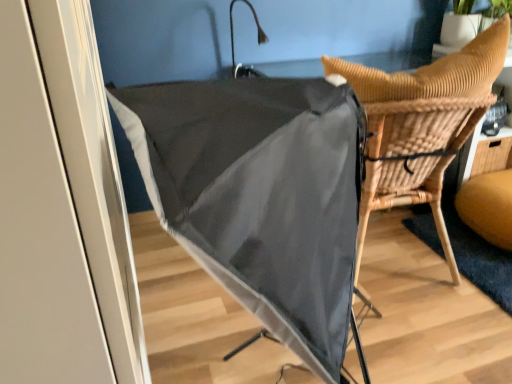
Question: Is woven wood chair at center not within woven wood table at right?

Choices:
 (A) yes
 (B) no

Answer: (A)

Question: Is woven wood chair at center positioned with its back to woven wood table at right?

Choices:
 (A) no
 (B) yes

Answer: (A)

Question: Is woven wood chair at center bigger than woven wood table at right?

Choices:
 (A) no
 (B) yes

Answer: (B)

Question: Is the depth of woven wood chair at center greater than that of woven wood table at right?

Choices:
 (A) no
 (B) yes

Answer: (A)

Question: From a real-world perspective, is woven wood chair at center positioned over woven wood table at right based on gravity?

Choices:
 (A) yes
 (B) no

Answer: (A)

Question: Is woven wood chair at center wider or thinner than matte black umbrella at center?

Choices:
 (A) wide
 (B) thin

Answer: (B)

Question: From a real-world perspective, is woven wood chair at center physically located above or below matte black umbrella at center?

Choices:
 (A) above
 (B) below

Answer: (B)

Question: Is woven wood chair at center to the left or to the right of matte black umbrella at center in the image?

Choices:
 (A) left
 (B) right

Answer: (B)

Question: Considering the positions of woven wood chair at center and matte black umbrella at center in the image, is woven wood chair at center bigger or smaller than matte black umbrella at center?

Choices:
 (A) big
 (B) small

Answer: (B)

Question: In terms of height, does matte black umbrella at center look taller or shorter compared to woven wood chair at center?

Choices:
 (A) short
 (B) tall

Answer: (B)

Question: Would you say matte black umbrella at center is to the left or to the right of woven wood chair at center in the picture?

Choices:
 (A) left
 (B) right

Answer: (A)

Question: From a real-world perspective, is matte black umbrella at center positioned above or below woven wood chair at center?

Choices:
 (A) above
 (B) below

Answer: (A)

Question: Considering their positions, is matte black umbrella at center located in front of or behind woven wood chair at center?

Choices:
 (A) behind
 (B) front

Answer: (B)

Question: From a real-world perspective, is woven wood chair at center physically located above or below woven wood table at right?

Choices:
 (A) below
 (B) above

Answer: (B)

Question: Visually, is woven wood chair at center positioned to the left or to the right of woven wood table at right?

Choices:
 (A) left
 (B) right

Answer: (A)